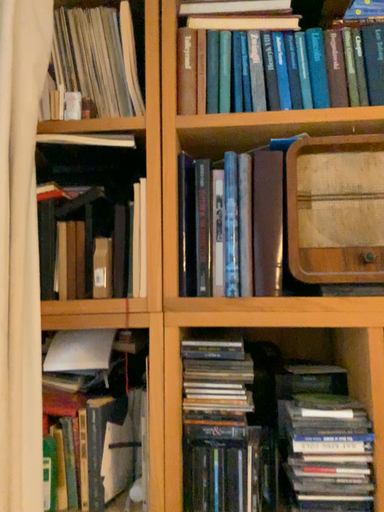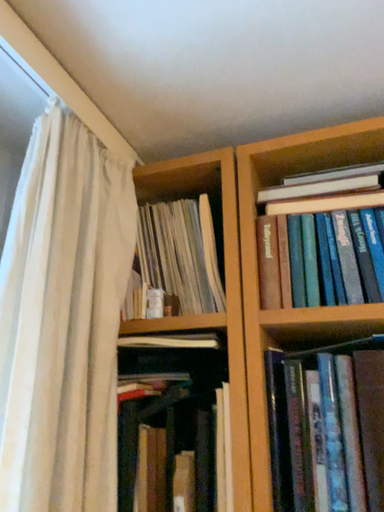
Question: Which way did the camera rotate in the video?

Choices:
 (A) rotated downward
 (B) rotated upward

Answer: (B)